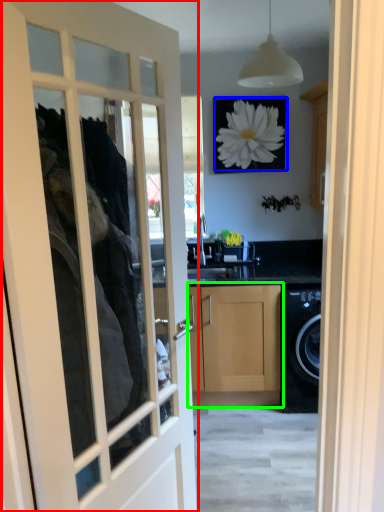
Question: Estimate the real-world distances between objects in this image. Which object is closer to door (highlighted by a red box), flower (highlighted by a blue box) or cabinetry (highlighted by a green box)?

Choices:
 (A) flower
 (B) cabinetry

Answer: (B)